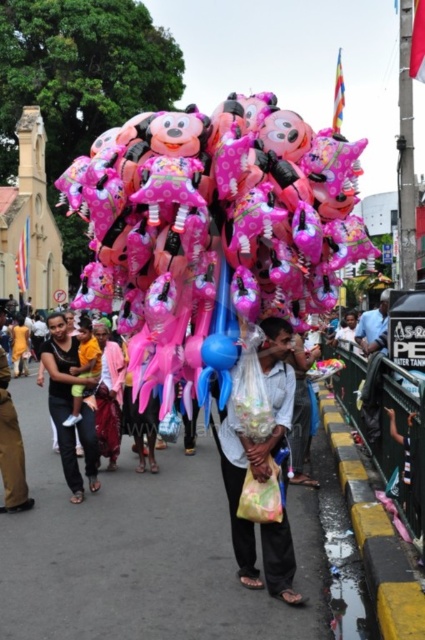
Question: Where is matte pink balloon at center located in relation to blue rubber balloon at center in the image?

Choices:
 (A) below
 (B) above

Answer: (B)

Question: Which of these objects is positioned farthest from the brown leather pants at lower left?

Choices:
 (A) blue rubber balloon at center
 (B) matte pink balloon at center
 (C) matte pink balloons at center

Answer: (B)

Question: Does pink matte balloons at center have a greater width compared to blue rubber balloon at center?

Choices:
 (A) yes
 (B) no

Answer: (A)

Question: Among these objects, which one is nearest to the camera?

Choices:
 (A) matte pink balloon at center
 (B) blue rubber balloon at center
 (C) brown leather pants at lower left

Answer: (B)

Question: Which point is farther to the camera?

Choices:
 (A) (224, 342)
 (B) (291, 208)

Answer: (A)

Question: Is pink matte balloons at center wider than matte pink balloons at center?

Choices:
 (A) yes
 (B) no

Answer: (A)